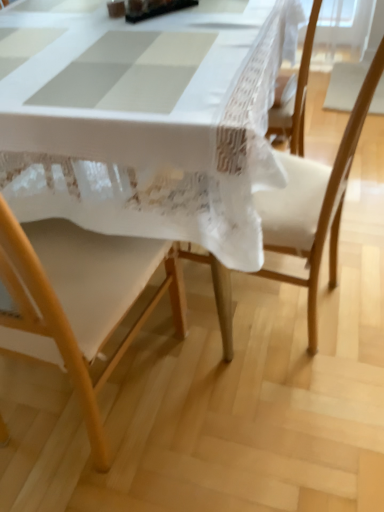
Question: Is point (241, 76) closer or farther from the camera than point (34, 254)?

Choices:
 (A) closer
 (B) farther

Answer: (B)

Question: From the image's perspective, is white lace tablecloth at center above or below wooden chair at lower left, acting as the 2th chair starting from the right?

Choices:
 (A) above
 (B) below

Answer: (A)

Question: Considering the real-world distances, which object is farthest from the wooden chair at center, arranged as the first chair when viewed from the right?

Choices:
 (A) white lace tablecloth at center
 (B) wooden chair at lower left, the 1th chair in the left-to-right sequence

Answer: (A)

Question: Which is nearer to the wooden chair at lower left, the 1th chair in the left-to-right sequence?

Choices:
 (A) white lace tablecloth at center
 (B) wooden chair at center, arranged as the first chair when viewed from the right

Answer: (A)